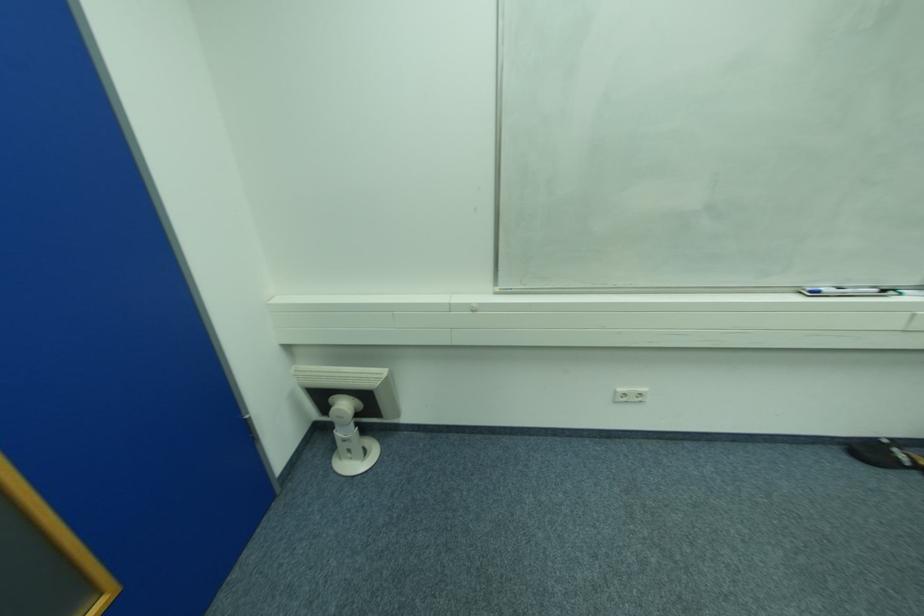
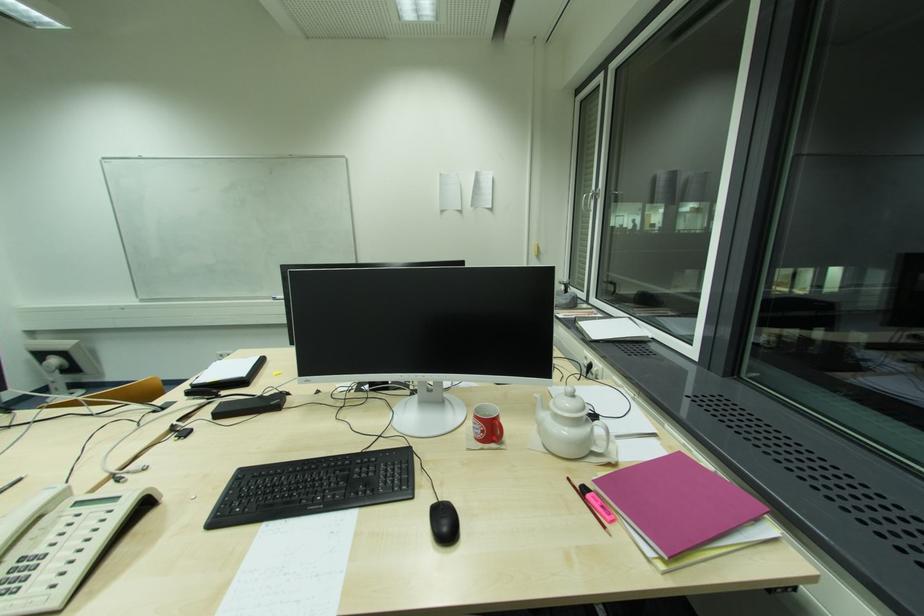
Which direction would the cameraman need to move to produce the second image?

The movement direction of the cameraman is right, backward.